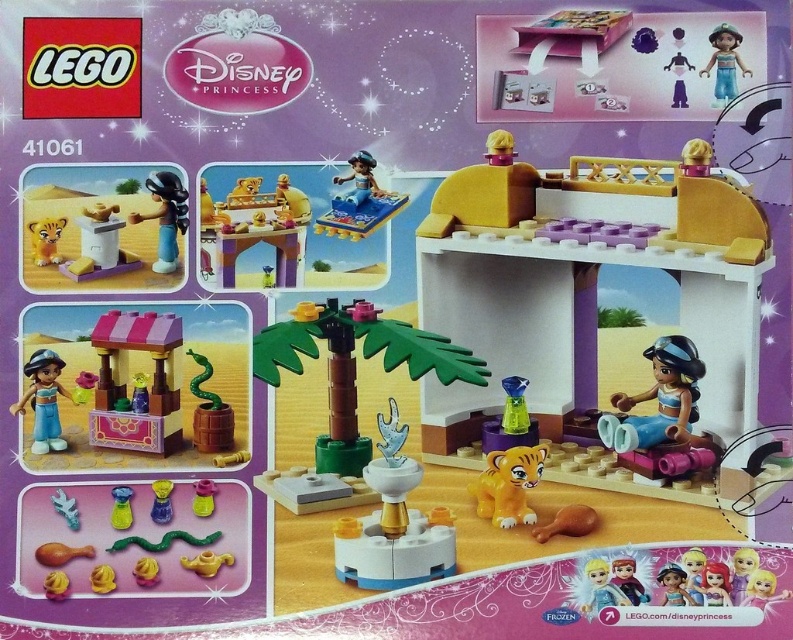
Does point (37, 394) come in front of point (711, 566)?

No, it is behind (711, 566).

Describe the element at coordinates (43, 401) in the screenshot. The image size is (793, 640). I see `matte blue doll at lower left` at that location.

Is point (48, 400) positioned after point (714, 602)?

Yes, point (48, 400) is behind point (714, 602).

At what (x,y) coordinates should I click in order to perform the action: click on matte blue doll at lower left. Please return your answer as a coordinate pair (x, y). Looking at the image, I should click on (43, 401).

The width and height of the screenshot is (793, 640). I want to click on matte orange tiger at left, so click(x=44, y=240).

What do you see at coordinates (661, 403) in the screenshot? Image resolution: width=793 pixels, height=640 pixels. I see `matte blue figure at lower right` at bounding box center [661, 403].

Is point (675, 428) positioned before point (152, 508)?

Yes, it is in front of point (152, 508).

Locate an element on the screen. This screenshot has height=640, width=793. matte blue figure at lower right is located at coordinates (661, 403).